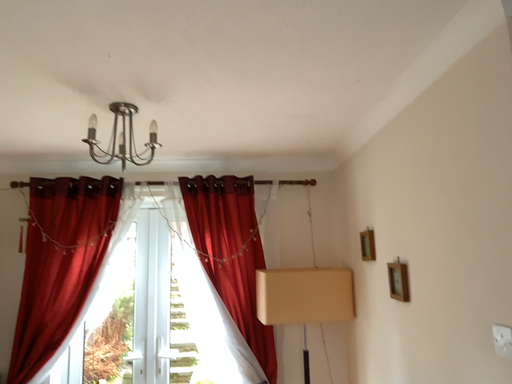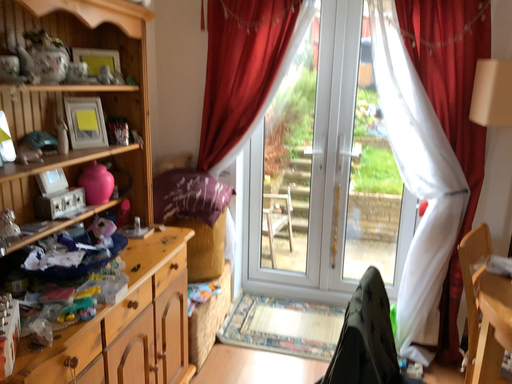
Question: Which way did the camera rotate in the video?

Choices:
 (A) rotated downward
 (B) rotated upward

Answer: (A)